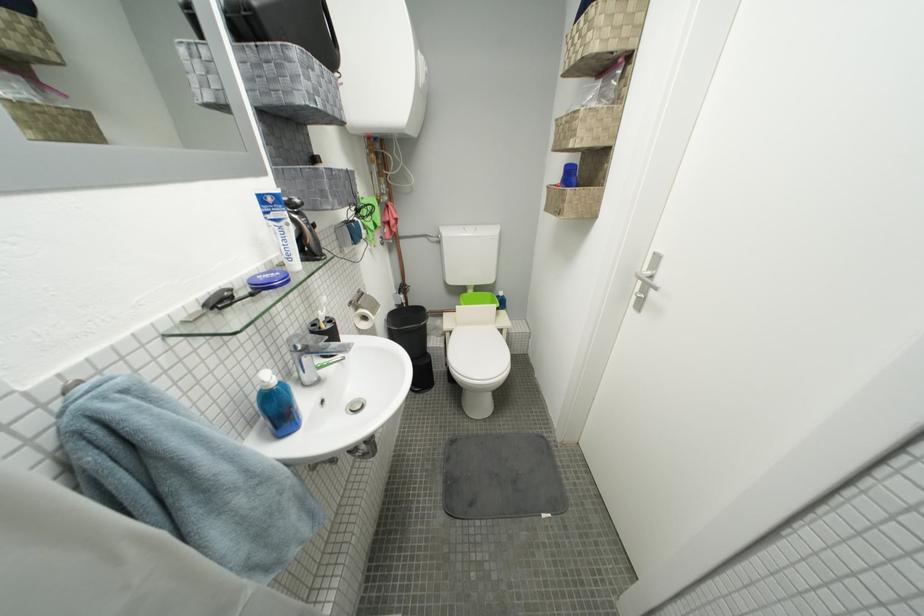
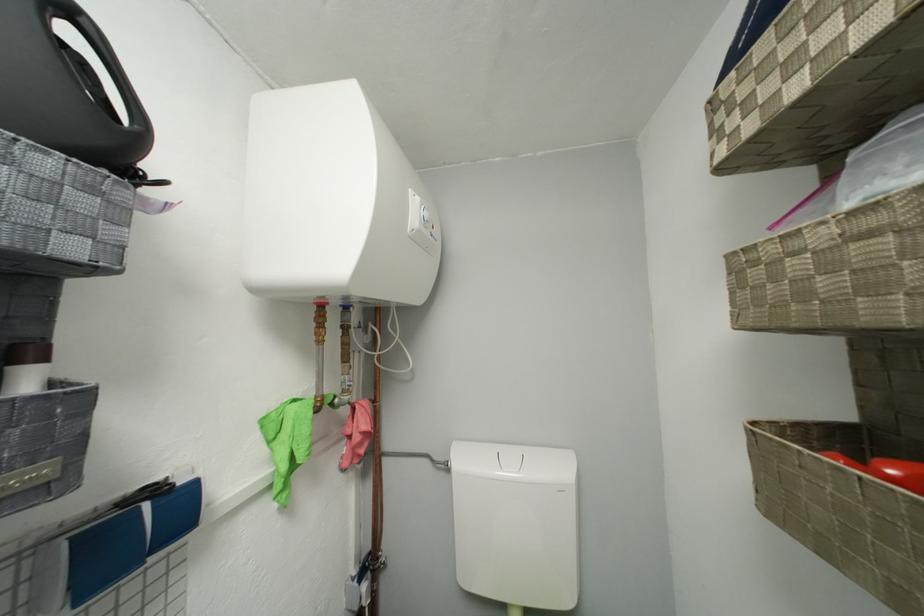
Where in the second image is the point corresponding to [396,223] from the first image?

(358, 435)